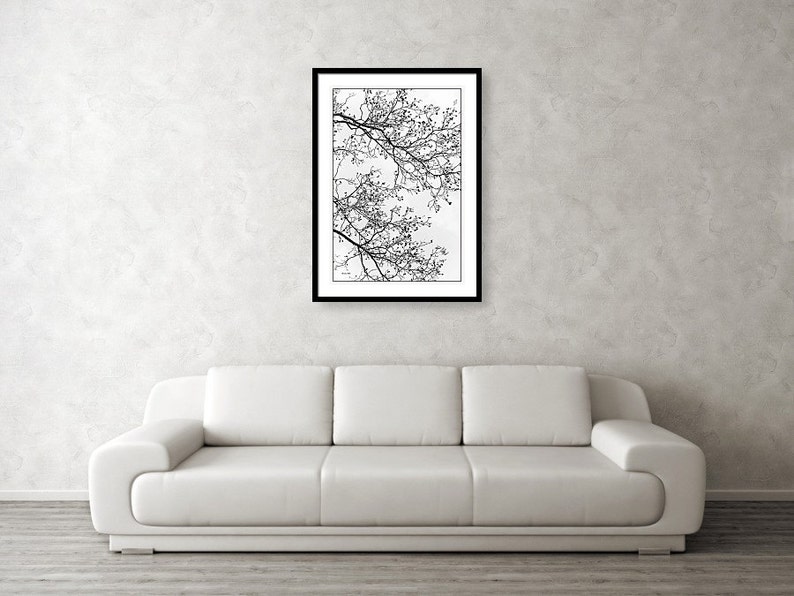
The height and width of the screenshot is (596, 794). I want to click on floor, so click(x=86, y=542), click(x=407, y=576), click(x=764, y=566).